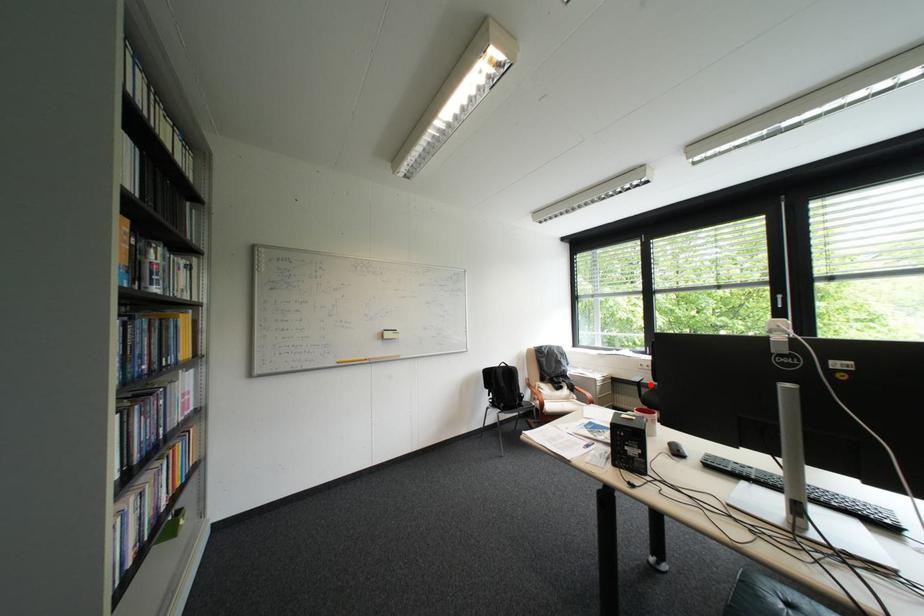
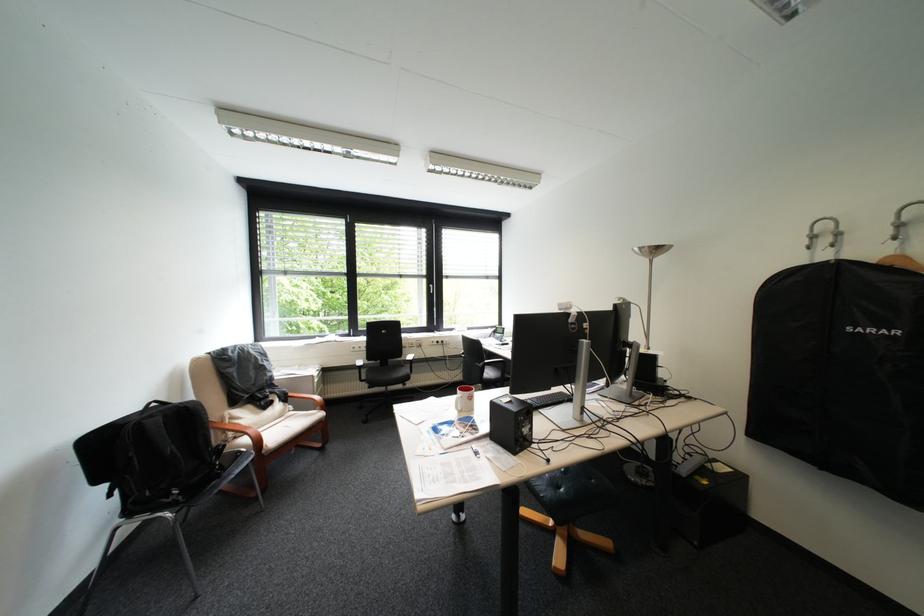
In the second image, find the point that corresponds to the highlighted location in the first image.

(371, 368)